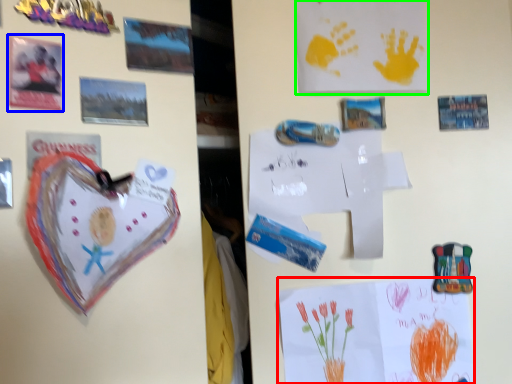
Question: Estimate the real-world distances between objects in this image. Which object is closer to postcard (highlighted by a red box), postcard (highlighted by a blue box) or postcard (highlighted by a green box)?

Choices:
 (A) postcard
 (B) postcard

Answer: (B)